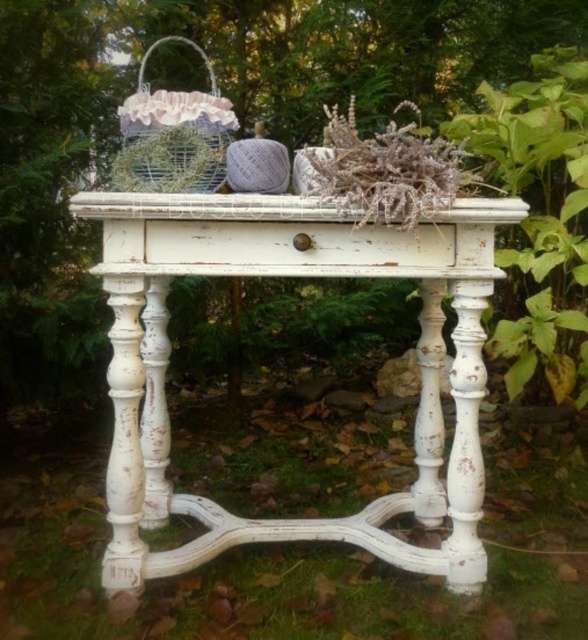
You are standing in front of the vintage table in the garden. There are two points marked on the table surface. Which point is closer to you, point (413, 545) or point (125, 173)?

Point (413, 545) is closer to you because it is further to the viewer than point (125, 173).

You are standing at the edge of a garden and want to take a photo of the white distressed wood table at center. If your camera can focus on objects up to 40 inches away, will it be able to capture the table clearly?

The white distressed wood table at center is 38.41 inches away from the camera, which is within the 40 inches focus range. Therefore, the camera can capture the table clearly.